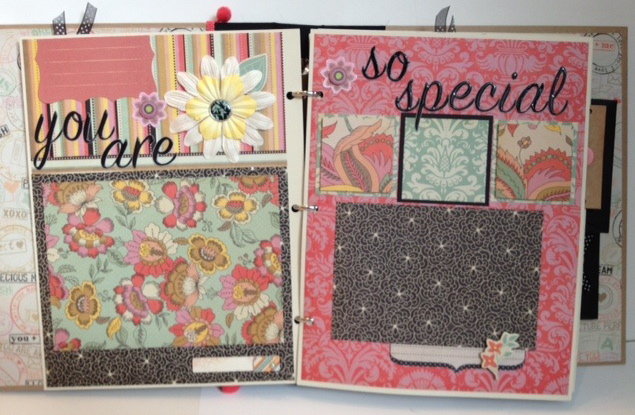
Identify the location of binder rings. This screenshot has height=415, width=635. (308, 94), (305, 207), (305, 321).